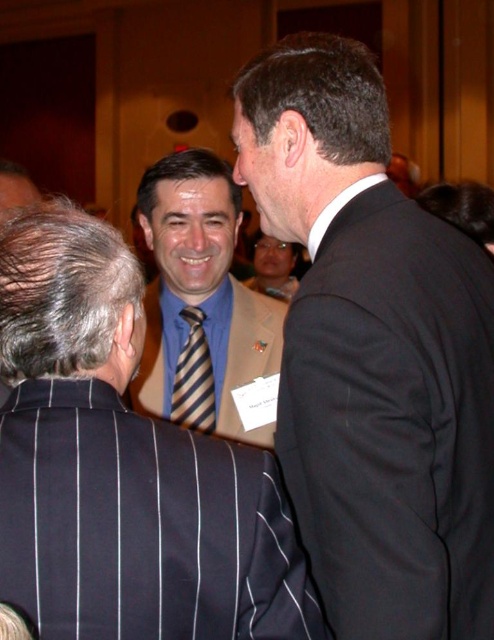
You are a photographer at this event and need to capture a closeup of both the blue striped tie at center and the striped fabric tie at center in a single shot. Given your camera has a minimum focus distance of 1.5 meters, will you be able to do this?

The blue striped tie at center is 1.53 meters from the striped fabric tie at center. Since the minimum focus distance is 1.5 meters, the distance between them is just slightly over the required distance, so the photographer can likely capture both in a single shot as the distance is sufficient.

You are organizing a charity event and need to arrange seating based on the formality of attendees. The black suit at right and the striped fabric tie at center are visible in the image. Which attendee should be seated closer to the stage for a more formal setting?

The black suit at right should be seated closer to the stage because it is larger in size than the striped fabric tie at center, indicating a higher level of formality.

You are organizing a photo shoot and need to ensure proper lighting for the black suit at right and the blue striped tie at center. Given that the minimum distance required between subjects for clear focus is 16 inches, will the current positioning allow both to be in focus simultaneously?

The black suit at right is 16.39 inches from the blue striped tie at center, which exceeds the minimum required distance of 16 inches. Therefore, both subjects can be in focus simultaneously.